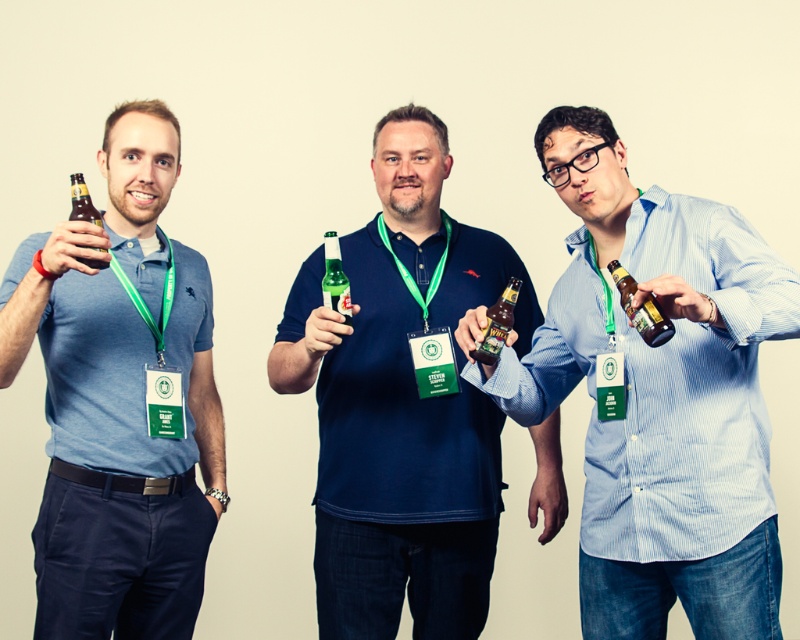
Question: Is green fabric lanyard at center to the left of brown glass beer at left from the viewer's perspective?

Choices:
 (A) no
 (B) yes

Answer: (A)

Question: Which of the following is the closest to the observer?

Choices:
 (A) (112, 452)
 (B) (164, 300)
 (C) (478, 356)
 (D) (640, 308)

Answer: (D)

Question: Which point is farther from the camera taking this photo?

Choices:
 (A) (492, 468)
 (B) (442, 257)

Answer: (B)

Question: Can you confirm if matte glass beer bottle at center is wider than green fabric lanyard at left?

Choices:
 (A) yes
 (B) no

Answer: (B)

Question: Is matte blue shirt at left below brown glass bottle at center?

Choices:
 (A) yes
 (B) no

Answer: (A)

Question: Among these points, which one is farthest from the camera?

Choices:
 (A) (476, 589)
 (B) (641, 337)
 (C) (388, 246)
 (D) (498, 353)

Answer: (C)